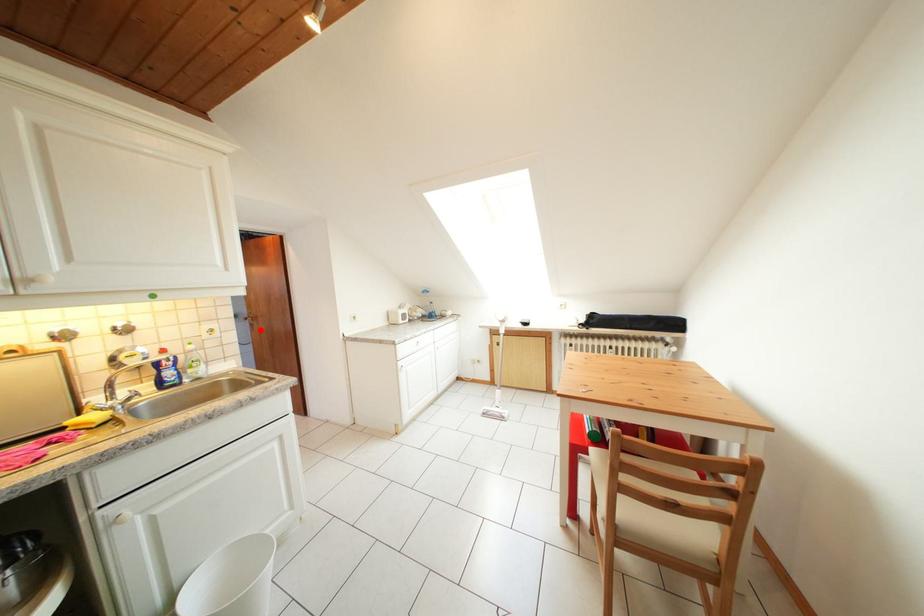
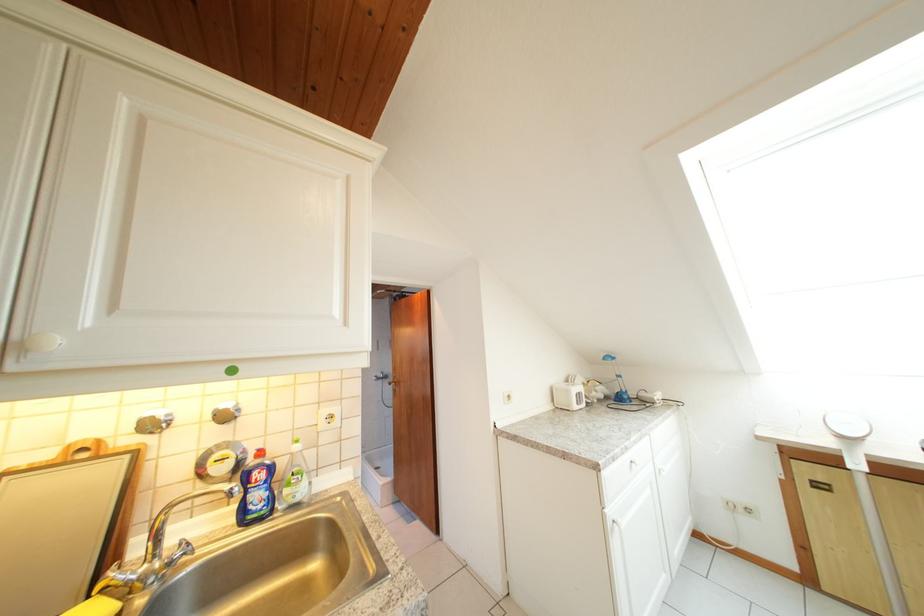
Question: I am providing you with two images of the same scene from different viewpoints. A red point is marked on the first image. Is the red point's position out of view in image 2?

Choices:
 (A) Yes
 (B) No

Answer: (B)